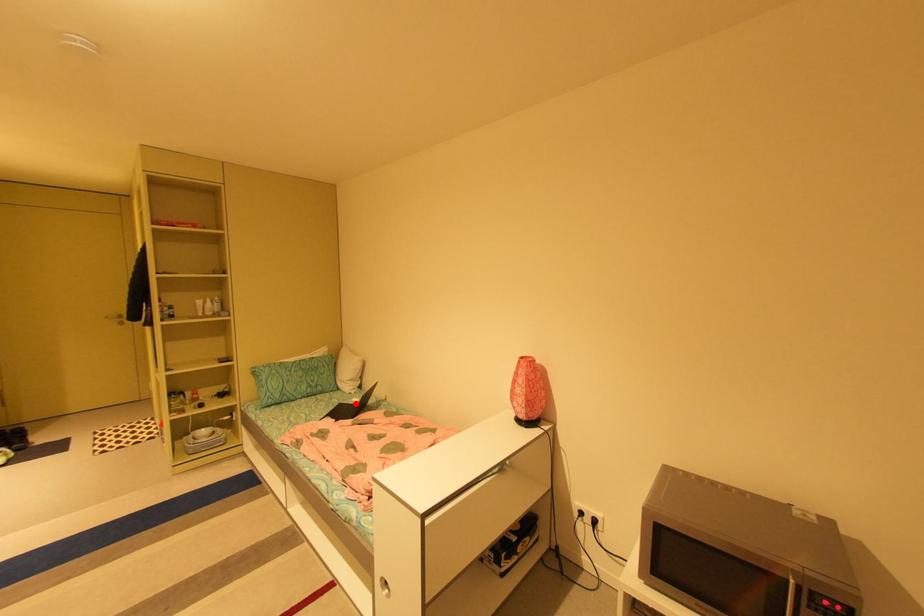
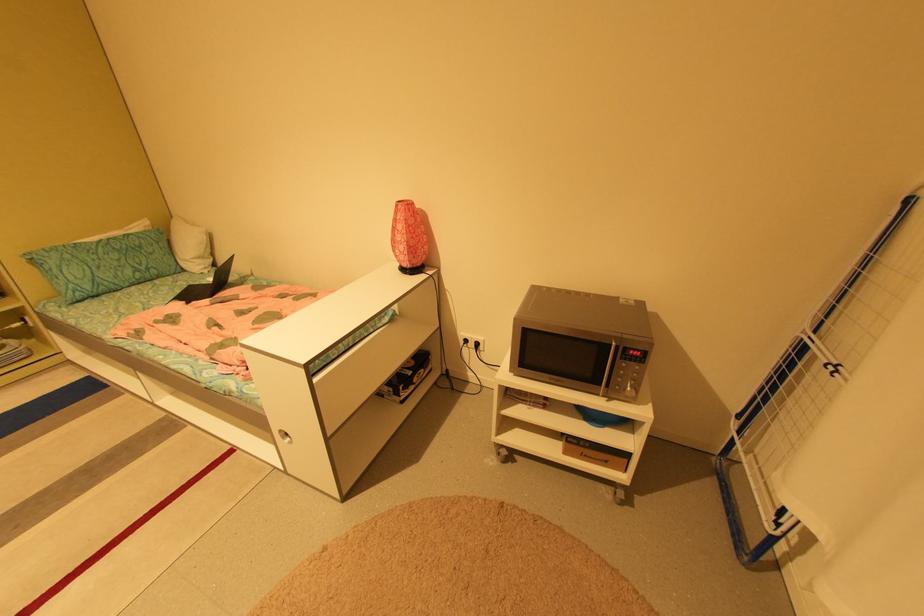
Question: I am providing you with two images of the same scene from different viewpoints. A red point is marked on the first image. Can you still see the location of the red point in image 2?

Choices:
 (A) Yes
 (B) No

Answer: (A)